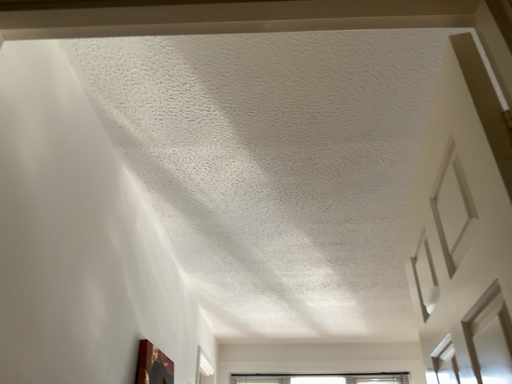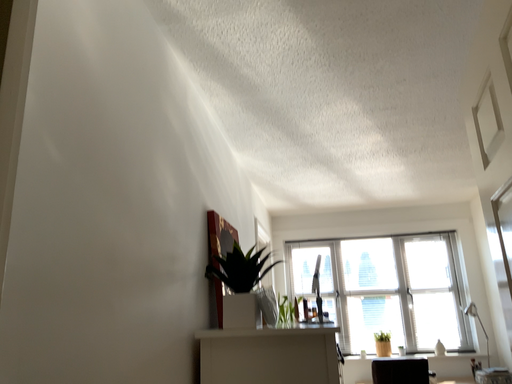
Question: Which way did the camera rotate in the video?

Choices:
 (A) rotated upward
 (B) rotated downward

Answer: (B)